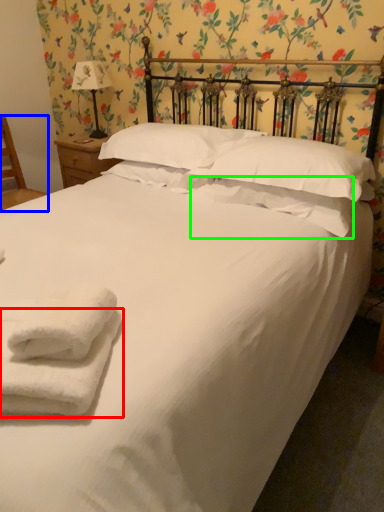
Question: Which is farther away from towel (highlighted by a red box)? armchair (highlighted by a blue box) or pillow (highlighted by a green box)?

Choices:
 (A) armchair
 (B) pillow

Answer: (A)